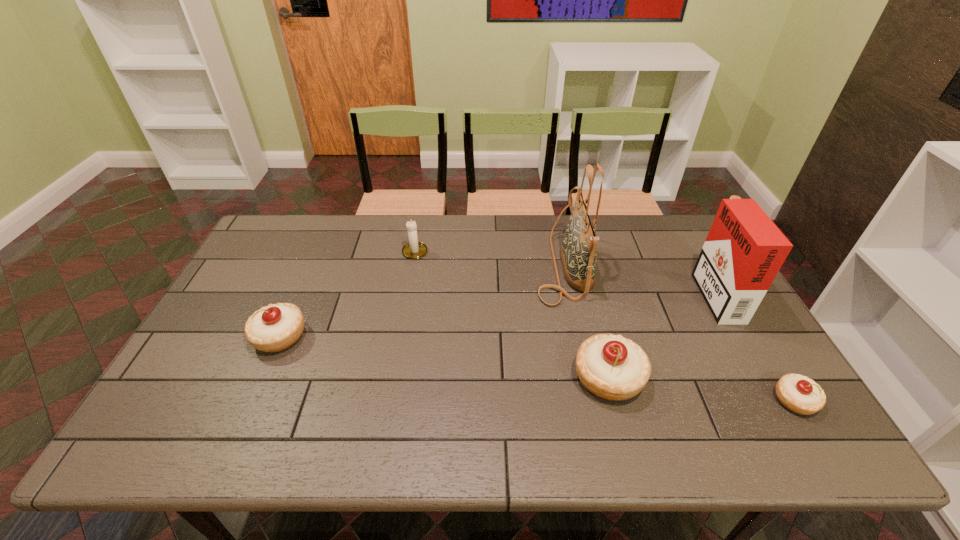
What are the coordinates of `blank area located on the back of the shortest pastry` in the screenshot? It's located at (723, 282).

Where is `vacant region located 0.100m on the handle side of the candle holder`? The width and height of the screenshot is (960, 540). vacant region located 0.100m on the handle side of the candle holder is located at coordinates (420, 224).

Where is `free space located 0.120m on the handle side of the candle holder`? free space located 0.120m on the handle side of the candle holder is located at coordinates (420, 221).

Image resolution: width=960 pixels, height=540 pixels. In order to click on vacant region located 0.160m on the handle side of the candle holder in this screenshot , I will do `click(421, 215)`.

Identify the location of free point located on the front-facing side of the handbag. (422, 266).

You are a GUI agent. You are given a task and a screenshot of the screen. Output one action in this format:
    pyautogui.click(x=<x>, y=<y>)
    Task: Click on the free space located 0.330m on the front-facing side of the handbag
    
    Given the screenshot: What is the action you would take?
    pyautogui.click(x=431, y=266)

Where is `free location located on the front-facing side of the handbag`? This screenshot has height=540, width=960. free location located on the front-facing side of the handbag is located at coordinates (488, 266).

Where is `vacant space located on the front-facing side of the cigarette case`? This screenshot has width=960, height=540. vacant space located on the front-facing side of the cigarette case is located at coordinates (571, 292).

Locate an element on the screen. The image size is (960, 540). free space located 0.180m on the front-facing side of the cigarette case is located at coordinates (640, 292).

I want to click on vacant position located on the front-facing side of the cigarette case, so click(x=667, y=292).